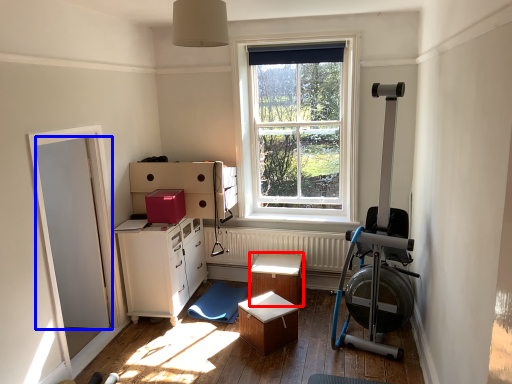
Question: Which of the following is the closest to the observer, table (highlighted by a red box) or door (highlighted by a blue box)?

Choices:
 (A) table
 (B) door

Answer: (B)